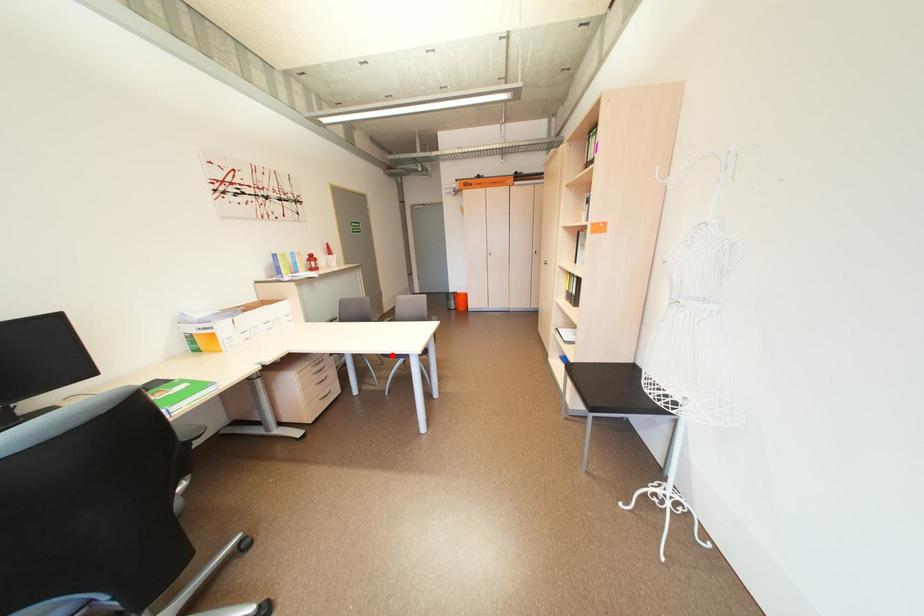
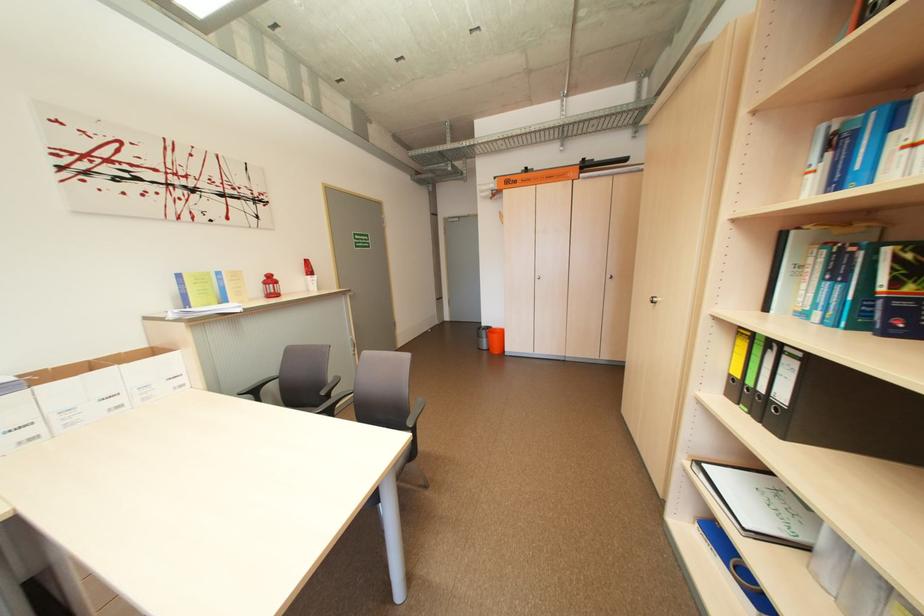
Question: I am providing you with two images of the same scene from different viewpoints. A red point is marked on the first image. Is the red point's position out of view in image 2?

Choices:
 (A) Yes
 (B) No

Answer: (A)